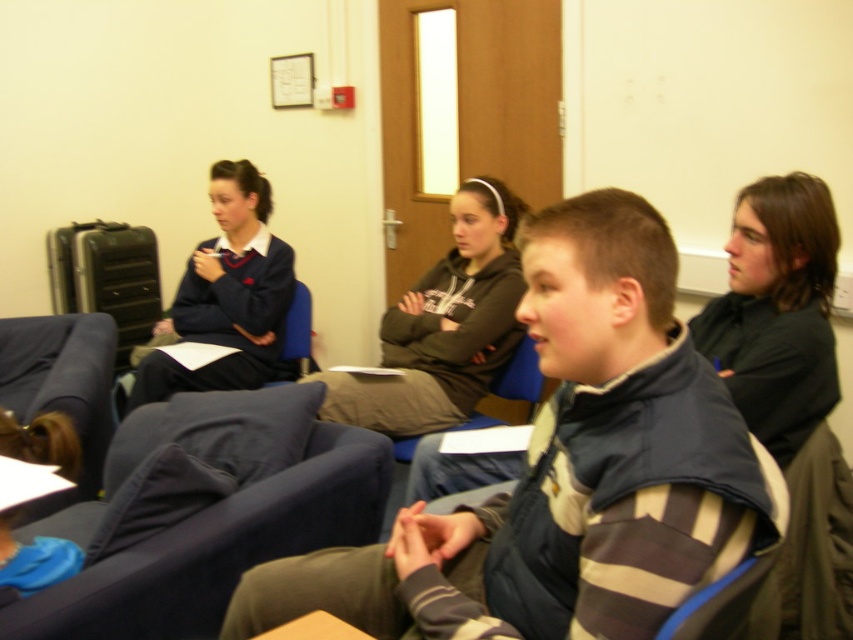
Question: Which of these objects is positioned farthest from the striped fleece jacket at center?

Choices:
 (A) matte blue uniform at left
 (B) dark gray hoodie at center

Answer: (A)

Question: Which point is closer to the camera?

Choices:
 (A) matte blue uniform at left
 (B) blue fabric chair at lower right
 (C) dark gray hoodie at center

Answer: (B)

Question: Does striped fleece jacket at center have a lesser width compared to blue fabric chair at lower right?

Choices:
 (A) yes
 (B) no

Answer: (B)

Question: Is dark gray hoodie at center further to the viewer compared to matte blue uniform at left?

Choices:
 (A) no
 (B) yes

Answer: (A)

Question: Is striped fleece jacket at center below matte blue uniform at left?

Choices:
 (A) yes
 (B) no

Answer: (A)

Question: Which point appears farthest from the camera in this image?

Choices:
 (A) (631, 221)
 (B) (480, 372)
 (C) (775, 616)

Answer: (B)